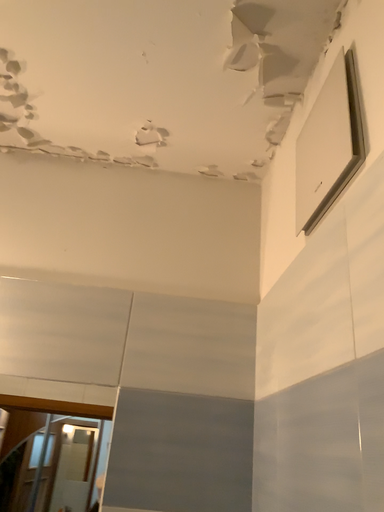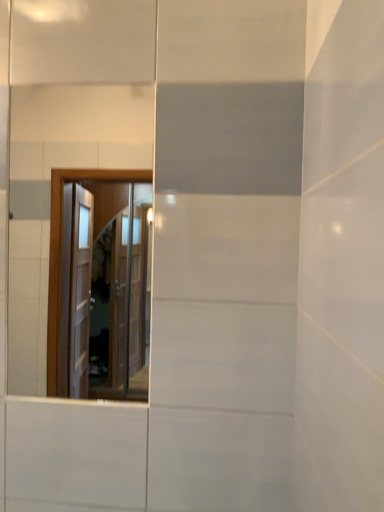
Question: Which way did the camera rotate in the video?

Choices:
 (A) rotated upward
 (B) rotated downward

Answer: (B)